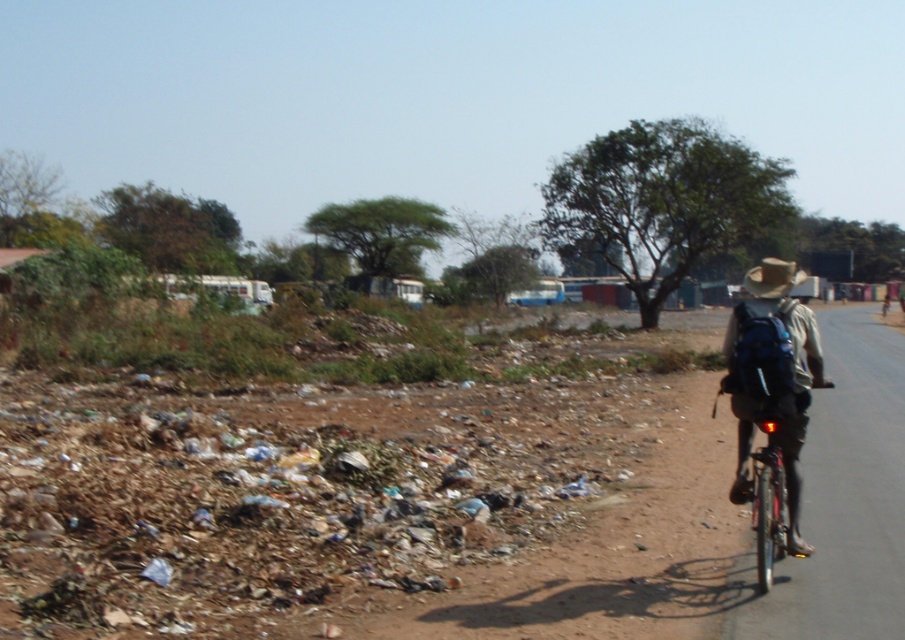
Is shiny metallic bicycle at right to the right of brown straw hat at right from the viewer's perspective?

No, shiny metallic bicycle at right is not to the right of brown straw hat at right.

Who is more distant from viewer, (783, 529) or (776, 296)?

The point (776, 296) is behind.

This screenshot has width=905, height=640. What do you see at coordinates (768, 500) in the screenshot?
I see `shiny metallic bicycle at right` at bounding box center [768, 500].

The height and width of the screenshot is (640, 905). In order to click on shiny metallic bicycle at right in this screenshot , I will do `click(768, 500)`.